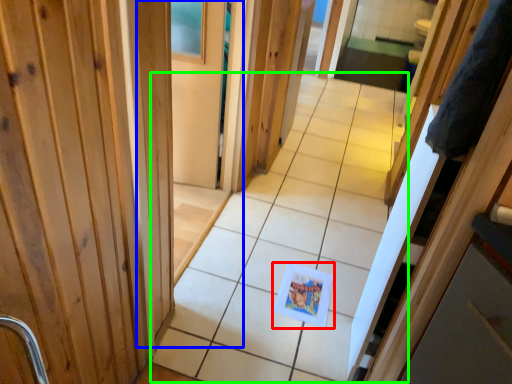
Question: Estimate the real-world distances between objects in this image. Which object is farther from postcard (highlighted by a red box), barn door (highlighted by a blue box) or path (highlighted by a green box)?

Choices:
 (A) barn door
 (B) path

Answer: (A)